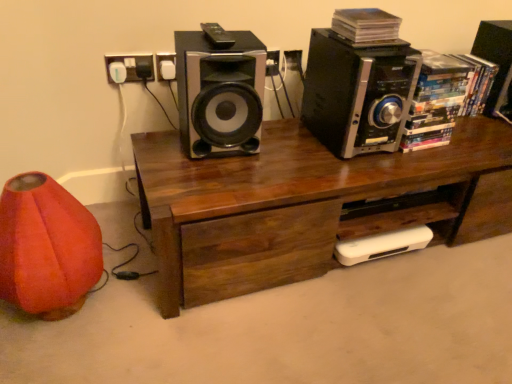
Question: Can you confirm if black metallic speaker at upper right, acting as the 2th speaker starting from the right, is positioned to the right of metallic silver speaker at center, which is counted as the 1th speaker, starting from the left?

Choices:
 (A) yes
 (B) no

Answer: (A)

Question: Are black metallic speaker at upper right, acting as the 2th speaker starting from the right, and metallic silver speaker at center, which is counted as the 1th speaker, starting from the left, beside each other?

Choices:
 (A) yes
 (B) no

Answer: (B)

Question: From a real-world perspective, is black metallic speaker at upper right, acting as the 2th speaker starting from the right, beneath metallic silver speaker at center, which is counted as the 1th speaker, starting from the left?

Choices:
 (A) no
 (B) yes

Answer: (B)

Question: Is black metallic speaker at upper right, acting as the 2th speaker starting from the right, facing towards metallic silver speaker at center, which ranks as the 3th speaker in right-to-left order?

Choices:
 (A) yes
 (B) no

Answer: (B)

Question: From the image's perspective, does black metallic speaker at upper right, acting as the 2th speaker starting from the right, appear higher than metallic silver speaker at center, which is counted as the 1th speaker, starting from the left?

Choices:
 (A) no
 (B) yes

Answer: (B)

Question: Is orange fabric bean bag chair at lower left wider or thinner than white plastic socket at upper left?

Choices:
 (A) wide
 (B) thin

Answer: (A)

Question: Would you say orange fabric bean bag chair at lower left is to the left or to the right of white plastic socket at upper left in the picture?

Choices:
 (A) right
 (B) left

Answer: (B)

Question: In the image, is orange fabric bean bag chair at lower left positioned in front of or behind white plastic socket at upper left?

Choices:
 (A) front
 (B) behind

Answer: (A)

Question: From the image's perspective, is orange fabric bean bag chair at lower left located above or below white plastic socket at upper left?

Choices:
 (A) above
 (B) below

Answer: (B)

Question: Considering the positions of black plastic remote control at upper center and black plastic speaker at upper right, the 1th speaker from the right, in the image, is black plastic remote control at upper center wider or thinner than black plastic speaker at upper right, the 1th speaker from the right,?

Choices:
 (A) thin
 (B) wide

Answer: (A)

Question: From the image's perspective, relative to black plastic speaker at upper right, the 1th speaker from the right, is black plastic remote control at upper center above or below?

Choices:
 (A) below
 (B) above

Answer: (A)

Question: Would you say black plastic remote control at upper center is inside or outside black plastic speaker at upper right, the 1th speaker from the right?

Choices:
 (A) outside
 (B) inside

Answer: (A)

Question: In terms of size, does black plastic remote control at upper center appear bigger or smaller than black plastic speaker at upper right, which is the third speaker in left-to-right order?

Choices:
 (A) small
 (B) big

Answer: (A)

Question: Choose the correct answer: Is orange fabric bean bag chair at lower left inside wooden desk at center or outside it?

Choices:
 (A) inside
 (B) outside

Answer: (B)

Question: In terms of size, does orange fabric bean bag chair at lower left appear bigger or smaller than wooden desk at center?

Choices:
 (A) small
 (B) big

Answer: (A)